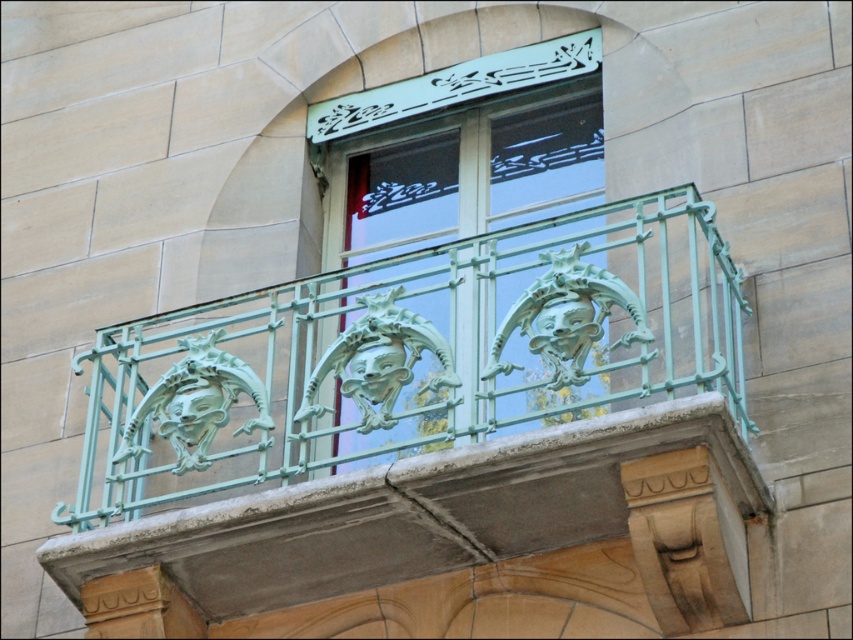
Question: Which object is closer to the camera taking this photo?

Choices:
 (A) smooth beige stone at lower right
 (B) green patina metal at upper center

Answer: (A)

Question: Can you confirm if green patina metal railing at center is positioned to the right of green patina metal at upper center?

Choices:
 (A) no
 (B) yes

Answer: (B)

Question: Which object is the farthest from the green patina metal railing at center?

Choices:
 (A) smooth beige stone at lower right
 (B) green patina metal at upper center

Answer: (B)

Question: Can you confirm if green patina metal railing at center is smaller than green patina metal at upper center?

Choices:
 (A) yes
 (B) no

Answer: (B)

Question: Which point is farther to the camera?

Choices:
 (A) (575, 534)
 (B) (334, 227)
 (C) (689, 529)

Answer: (B)

Question: Can you confirm if green patina metal railing at center is positioned above smooth beige stone at lower right?

Choices:
 (A) no
 (B) yes

Answer: (B)